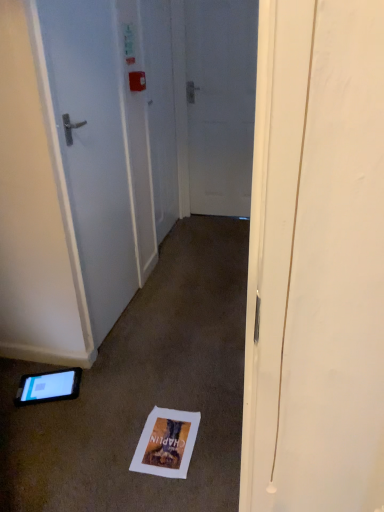
Question: Can you confirm if white paper postcard at lower center is wider than white matte door at center, which is counted as the first door, starting from the back?

Choices:
 (A) no
 (B) yes

Answer: (B)

Question: Is white paper postcard at lower center located outside white matte door at center, acting as the first door starting from the right?

Choices:
 (A) yes
 (B) no

Answer: (A)

Question: Would you consider white paper postcard at lower center to be distant from white matte door at center, acting as the first door starting from the right?

Choices:
 (A) yes
 (B) no

Answer: (A)

Question: From a real-world perspective, is white paper postcard at lower center beneath white matte door at center, which is counted as the first door, starting from the back?

Choices:
 (A) no
 (B) yes

Answer: (B)

Question: From the image's perspective, is white paper postcard at lower center over white matte door at center, placed as the second door when sorted from left to right?

Choices:
 (A) no
 (B) yes

Answer: (A)

Question: In the image, is white matte door at center, the second door positioned from the front, on the left side or the right side of white paper postcard at lower center?

Choices:
 (A) left
 (B) right

Answer: (B)

Question: Considering the positions of white matte door at center, acting as the first door starting from the right, and white paper postcard at lower center in the image, is white matte door at center, acting as the first door starting from the right, wider or thinner than white paper postcard at lower center?

Choices:
 (A) wide
 (B) thin

Answer: (B)

Question: From a real-world perspective, relative to white paper postcard at lower center, is white matte door at center, placed as the second door when sorted from left to right, vertically above or below?

Choices:
 (A) below
 (B) above

Answer: (B)

Question: Is white matte door at center, the second door positioned from the front, bigger or smaller than white paper postcard at lower center?

Choices:
 (A) small
 (B) big

Answer: (B)

Question: Considering their positions, is white glossy door at left, marked as the 2th door in a back-to-front arrangement, located in front of or behind white paper postcard at lower center?

Choices:
 (A) behind
 (B) front

Answer: (B)

Question: Is white glossy door at left, the 1th door in the left-to-right sequence, wider or thinner than white paper postcard at lower center?

Choices:
 (A) thin
 (B) wide

Answer: (A)

Question: In terms of size, does white glossy door at left, which is the second door in right-to-left order, appear bigger or smaller than white paper postcard at lower center?

Choices:
 (A) small
 (B) big

Answer: (B)

Question: In the image, is white glossy door at left, the 1th door in the left-to-right sequence, on the left side or the right side of white paper postcard at lower center?

Choices:
 (A) left
 (B) right

Answer: (A)

Question: From a real-world perspective, relative to black glossy tablet at lower left, is white glossy door at left, which is the second door in right-to-left order, vertically above or below?

Choices:
 (A) below
 (B) above

Answer: (B)

Question: Considering the positions of white glossy door at left, which is the second door in right-to-left order, and black glossy tablet at lower left in the image, is white glossy door at left, which is the second door in right-to-left order, taller or shorter than black glossy tablet at lower left?

Choices:
 (A) tall
 (B) short

Answer: (A)